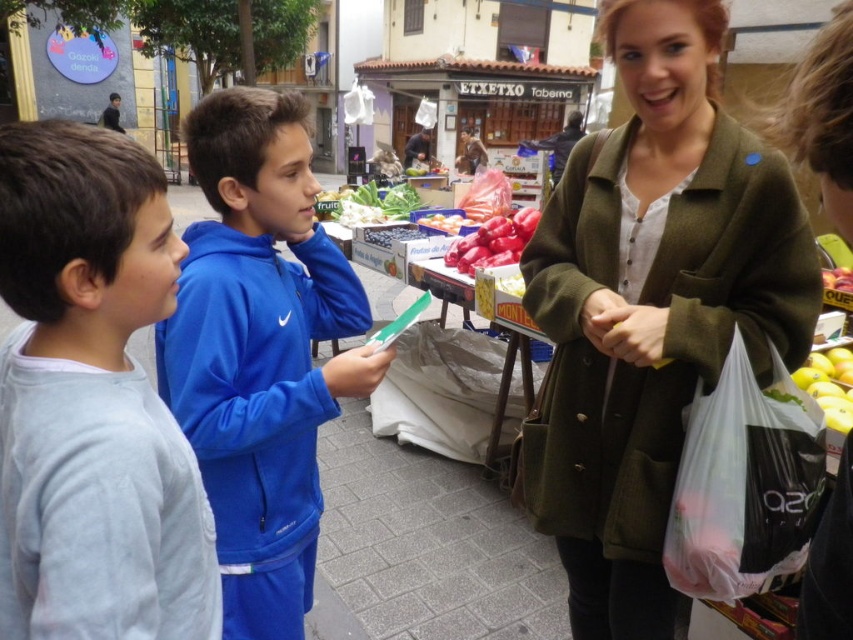
You are standing at point (51, 170) and want to walk to point (523, 500). Is the path between these two points clear of any obstacles?

The path between point (51, 170) and point (523, 500) is clear because there are no objects blocking the way according to the scene description provided.

You are a street vendor who needs to place a new sign between the blue fleece jacket at center and the green leafy vegetables at center. To ensure the sign is visible to customers passing by, where should you place it?

The blue fleece jacket at center is positioned on the right side of green leafy vegetables at center. Therefore, placing the sign between them would require placing it to the right of the green leafy vegetables at center and to the left of the blue fleece jacket at center, ensuring visibility between the two items.

You are a photographer trying to capture a photo of the green woolen coat at center and the red matte tomatoes at center in the same frame. Based on their positions, which object should you adjust your camera to focus on first to ensure both are in the frame?

The green woolen coat at center is to the right of red matte tomatoes at center, so you should focus on the red matte tomatoes at center first to ensure both are in the frame.